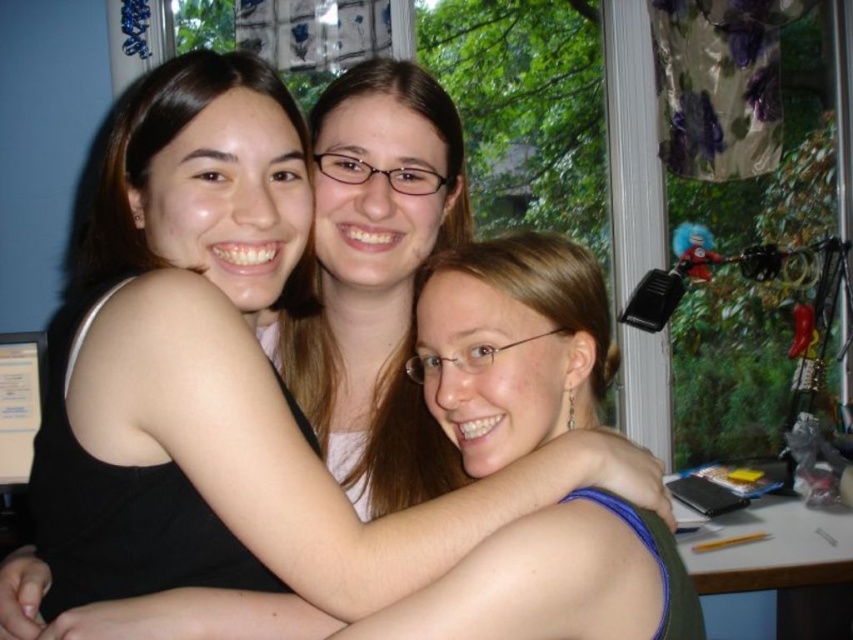
You are a photographer standing at the camera position. You want to adjust the focus to the black matte tank top at left. Is the tank top within the camera focus range of 25 inches?

The black matte tank top at left and the camera are 27.30 inches apart, which is beyond the camera focus range of 25 inches. The tank top is out of focus.